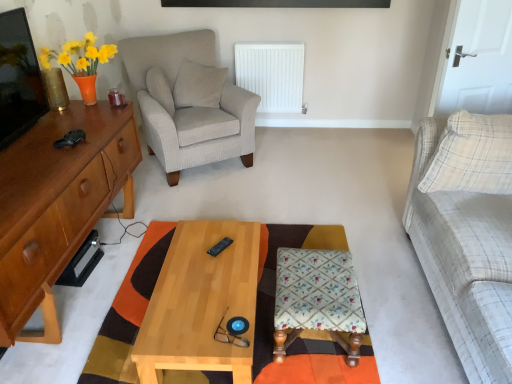
The width and height of the screenshot is (512, 384). I want to click on empty space that is ontop of floral fabric stool at center, so click(320, 282).